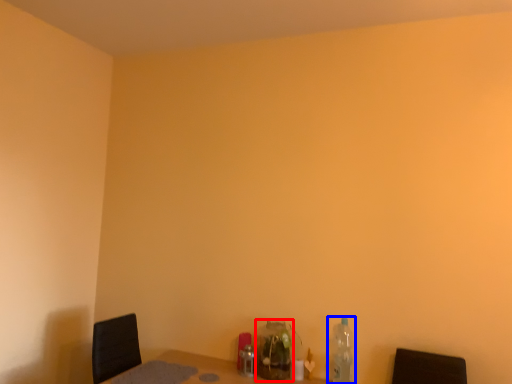
Question: Which point is further to the camera, bottle (highlighted by a red box) or bottle (highlighted by a blue box)?

Choices:
 (A) bottle
 (B) bottle

Answer: (A)